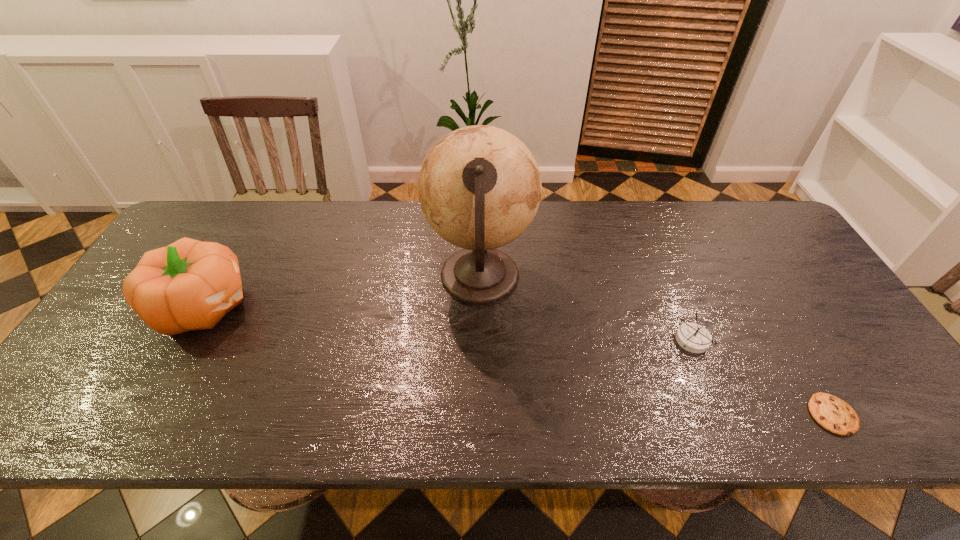
At what (x,y) coordinates should I click in order to perform the action: click on globe. Please return your answer as a coordinate pair (x, y). The width and height of the screenshot is (960, 540). Looking at the image, I should click on (479, 187).

In order to click on the tallest object in this screenshot , I will do `click(479, 187)`.

Find the location of a particular element. The width and height of the screenshot is (960, 540). the third shortest object is located at coordinates (188, 285).

Find the location of a particular element. the leftmost object is located at coordinates (188, 285).

Find the location of `the second shortest object`. the second shortest object is located at coordinates (692, 337).

Image resolution: width=960 pixels, height=540 pixels. What are the coordinates of `the third object from left to right` in the screenshot? It's located at (692, 337).

The width and height of the screenshot is (960, 540). What are the coordinates of `the nearest object` in the screenshot? It's located at (833, 414).

Locate an element on the screen. The width and height of the screenshot is (960, 540). the rightmost object is located at coordinates (833, 414).

You are a GUI agent. You are given a task and a screenshot of the screen. Output one action in this format:
    pyautogui.click(x=<x>, y=<y>)
    Task: Click on the vacant space located 0.280m on the front-facing side of the globe
    
    Given the screenshot: What is the action you would take?
    pyautogui.click(x=631, y=277)

Locate an element on the screen. The width and height of the screenshot is (960, 540). vacant space located 0.120m on the carved face of the pumpkin is located at coordinates (298, 306).